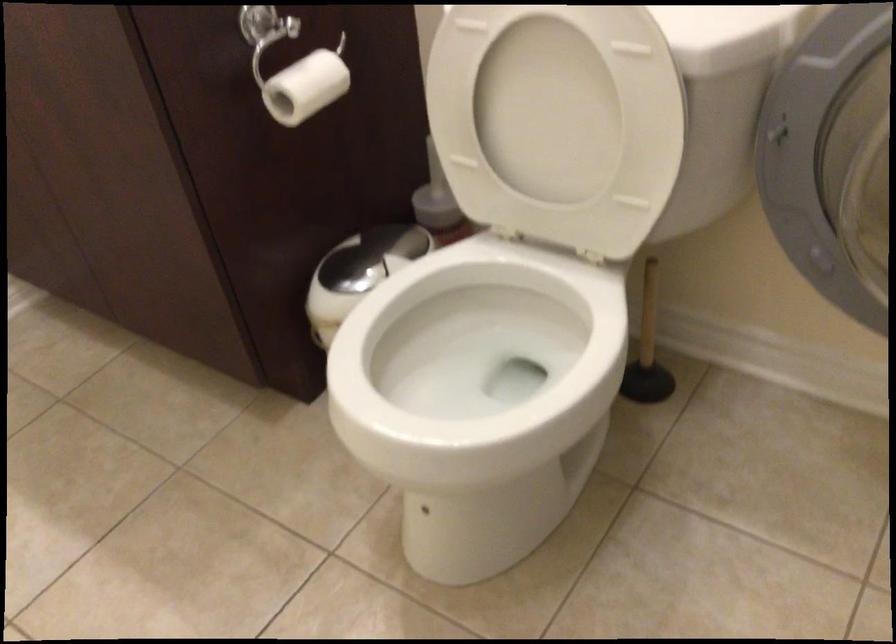
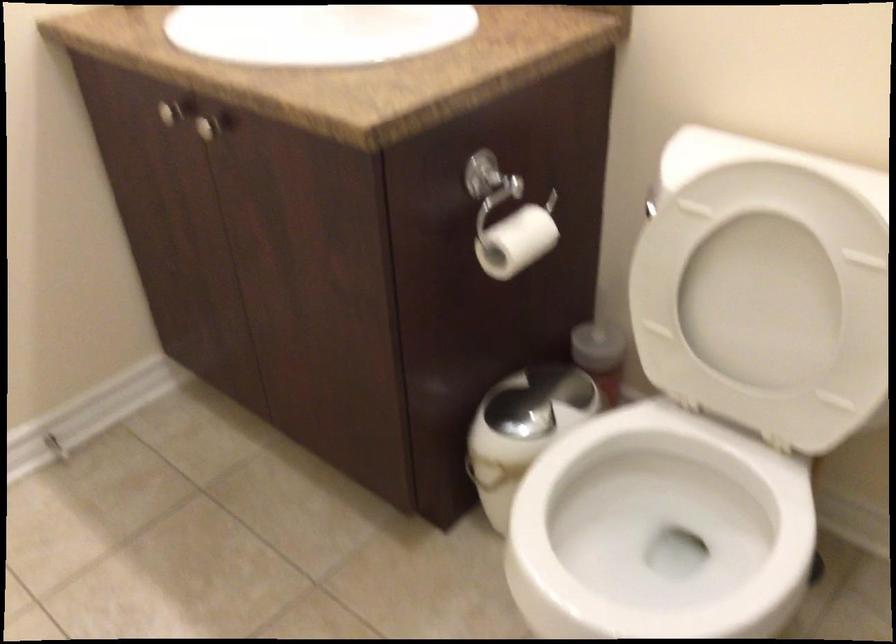
Locate, in the second image, the point that corresponds to [300,88] in the first image.

(515, 242)